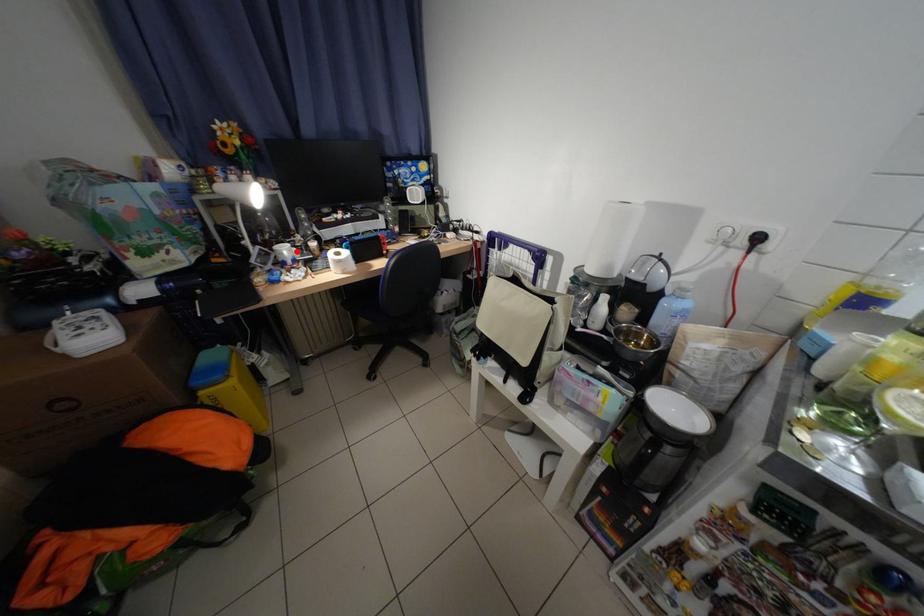
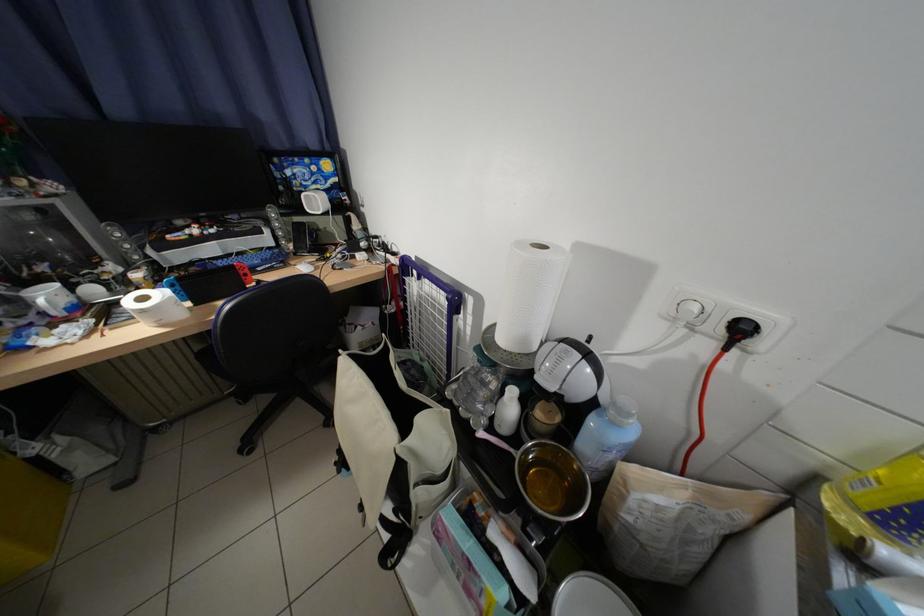
Question: I am providing you with two images of the same scene from different viewpoints. Given a red point in image1, look at the same physical point in image2. Is it:

Choices:
 (A) Closer to the viewpoint
 (B) Farther from the viewpoint

Answer: (B)